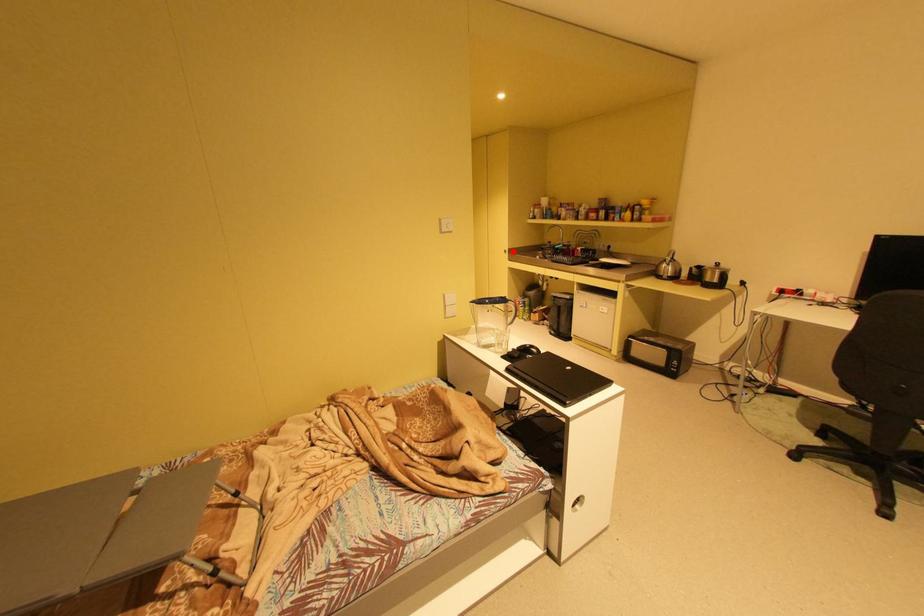
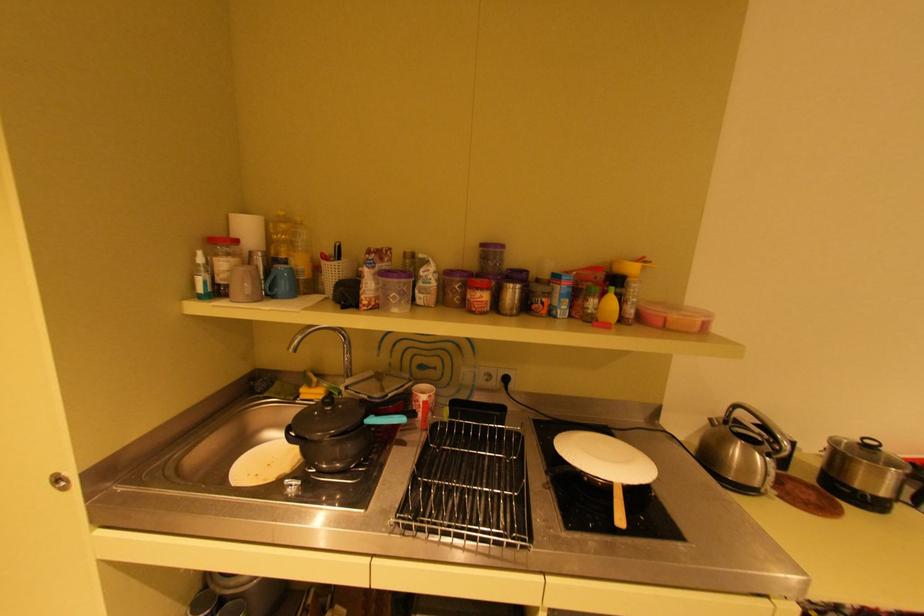
Question: I am providing you with two images of the same scene from different viewpoints. A red point is shown in image1. For the corresponding object point in image2, is it positioned nearer or farther from the camera?

Choices:
 (A) Nearer
 (B) Farther

Answer: (A)